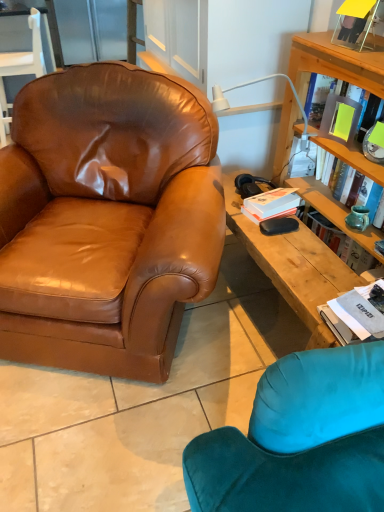
Question: Considering the positions of brown leather armchair at upper left, placed as the 2th chair when sorted from bottom to top, and white plastic lamp at upper right in the image, is brown leather armchair at upper left, placed as the 2th chair when sorted from bottom to top, taller or shorter than white plastic lamp at upper right?

Choices:
 (A) tall
 (B) short

Answer: (A)

Question: Considering the positions of brown leather armchair at upper left, which is the first chair in left-to-right order, and white plastic lamp at upper right in the image, is brown leather armchair at upper left, which is the first chair in left-to-right order, wider or thinner than white plastic lamp at upper right?

Choices:
 (A) thin
 (B) wide

Answer: (A)

Question: Considering the real-world distances, which object is farthest from the brown leather armchair at upper left, placed as the 2th chair when sorted from bottom to top?

Choices:
 (A) matte teal vase at upper right
 (B) white matte paperback book at upper right
 (C) yellow matte book at upper right, which is counted as the first book, starting from the top
 (D) teal ceramic vase at right
 (E) brown leather chair at left, the 1th chair ordered from the bottom

Answer: (D)

Question: Estimate the real-world distances between objects in this image. Which object is farther from the brown leather armchair at upper left, the first chair from the back?

Choices:
 (A) white matte paperback book at upper right
 (B) white paper book at right, the second book when ordered from back to front
 (C) teal ceramic vase at right
 (D) matte teal vase at upper right
 (E) white plastic lamp at upper right

Answer: (B)